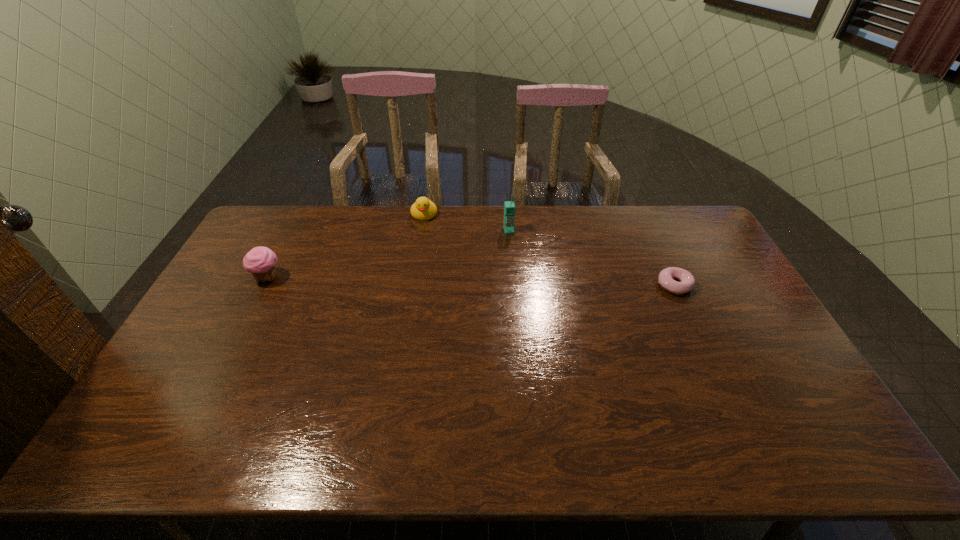
You are a GUI agent. You are given a task and a screenshot of the screen. Output one action in this format:
    pyautogui.click(x=<x>, y=<y>)
    Task: Click on the vacant space on the desktop that is between the cupcake and the doughnut and is positioned on the keypad of the third nearest object
    
    Given the screenshot: What is the action you would take?
    pyautogui.click(x=522, y=282)

Where is `free space on the desktop that is between the leftmost object and the doughnut and is positioned on the face of the third tallest object`? The image size is (960, 540). free space on the desktop that is between the leftmost object and the doughnut and is positioned on the face of the third tallest object is located at coordinates (417, 280).